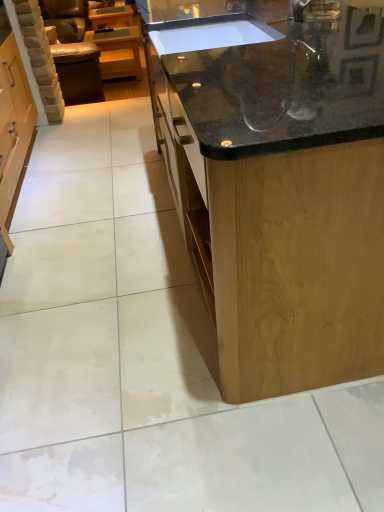
Question: Which direction should I rotate to face black granite countertop at center, which appears as the 2th countertop when viewed from the front, — up or down?

Choices:
 (A) down
 (B) up

Answer: (B)

Question: Which direction should I rotate to face black granite countertop at center, marked as the 2th countertop in a back-to-front arrangement, — up or down?

Choices:
 (A) down
 (B) up

Answer: (B)

Question: Is leather armchair at left not close to black granite countertop at center, which appears as the 2th countertop when viewed from the front?

Choices:
 (A) no
 (B) yes

Answer: (B)

Question: Is leather armchair at left aimed at black granite countertop at center, which appears as the 2th countertop when viewed from the front?

Choices:
 (A) yes
 (B) no

Answer: (B)

Question: Considering the relative positions of leather armchair at left and black granite countertop at center, acting as the first countertop starting from the back, in the image provided, is leather armchair at left to the left of black granite countertop at center, acting as the first countertop starting from the back, from the viewer's perspective?

Choices:
 (A) no
 (B) yes

Answer: (B)

Question: Considering the relative sizes of leather armchair at left and black granite countertop at center, which appears as the 2th countertop when viewed from the front, in the image provided, is leather armchair at left bigger than black granite countertop at center, which appears as the 2th countertop when viewed from the front,?

Choices:
 (A) yes
 (B) no

Answer: (A)

Question: Can you confirm if leather armchair at left is shorter than black granite countertop at center, acting as the first countertop starting from the back?

Choices:
 (A) yes
 (B) no

Answer: (B)

Question: Is leather armchair at left positioned with its back to black granite countertop at center, acting as the first countertop starting from the back?

Choices:
 (A) yes
 (B) no

Answer: (B)

Question: Is black granite countertop at center, acting as the first countertop starting from the back, wider than matte wood cabinet at upper left?

Choices:
 (A) no
 (B) yes

Answer: (B)

Question: Is black granite countertop at center, which appears as the 2th countertop when viewed from the front, at the right side of matte wood cabinet at upper left?

Choices:
 (A) yes
 (B) no

Answer: (A)

Question: From a real-world perspective, is black granite countertop at center, which appears as the 2th countertop when viewed from the front, on matte wood cabinet at upper left?

Choices:
 (A) yes
 (B) no

Answer: (A)

Question: Considering the relative sizes of black granite countertop at center, acting as the first countertop starting from the back, and matte wood cabinet at upper left in the image provided, is black granite countertop at center, acting as the first countertop starting from the back, smaller than matte wood cabinet at upper left?

Choices:
 (A) yes
 (B) no

Answer: (A)

Question: Is the depth of black granite countertop at center, which appears as the 2th countertop when viewed from the front, greater than that of matte wood cabinet at upper left?

Choices:
 (A) yes
 (B) no

Answer: (B)

Question: Does black granite countertop at center, acting as the first countertop starting from the back, have a larger size compared to matte wood cabinet at upper left?

Choices:
 (A) no
 (B) yes

Answer: (A)

Question: Is leather armchair at left taller than matte wood cabinet at upper left?

Choices:
 (A) yes
 (B) no

Answer: (A)